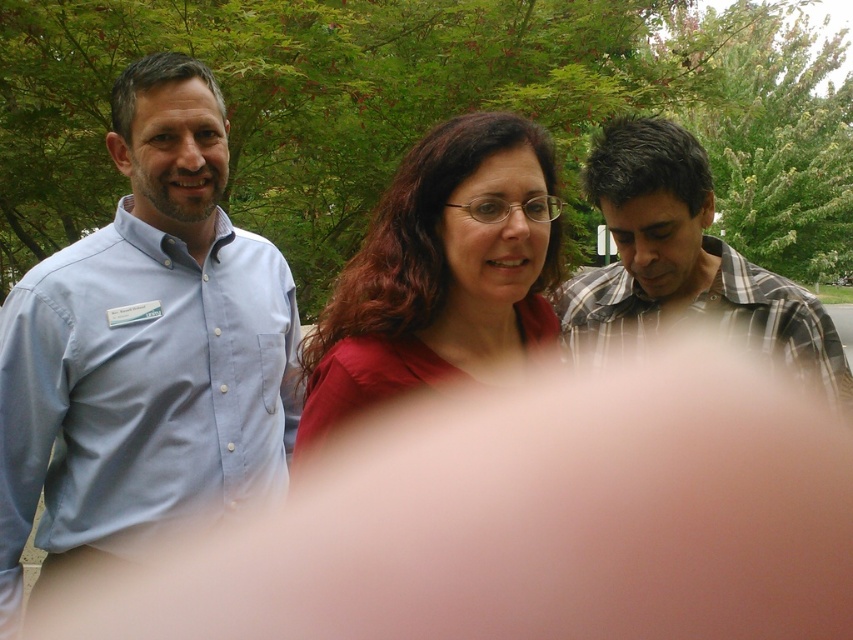
Does light blue button-down shirt at left have a greater width compared to plaid cotton shirt at right?

In fact, light blue button-down shirt at left might be narrower than plaid cotton shirt at right.

Which is above, light blue button-down shirt at left or plaid cotton shirt at right?

plaid cotton shirt at right is higher up.

Does point (10, 600) lie behind point (665, 268)?

No, (10, 600) is closer to viewer.

Identify the location of light blue button-down shirt at left. (144, 346).

Does matte red shirt at center appear on the right side of plaid cotton shirt at right?

Incorrect, matte red shirt at center is not on the right side of plaid cotton shirt at right.

Image resolution: width=853 pixels, height=640 pixels. Identify the location of matte red shirt at center. (440, 273).

Does point (303, 362) come in front of point (668, 131)?

Yes, point (303, 362) is in front of point (668, 131).

Image resolution: width=853 pixels, height=640 pixels. In order to click on matte red shirt at center in this screenshot , I will do [x=440, y=273].

Which is behind, point (264, 378) or point (376, 243)?

The point (264, 378) is behind.

Between point (73, 252) and point (421, 216), which one is positioned in front?

Point (421, 216)

The image size is (853, 640). In order to click on light blue button-down shirt at left in this screenshot , I will do pyautogui.click(x=144, y=346).